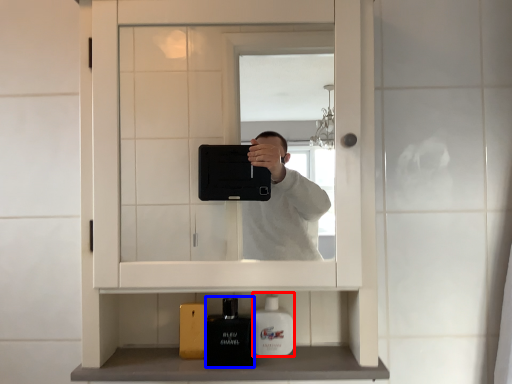
Question: Which point is closer to the camera, mouthwash (highlighted by a red box) or toiletry (highlighted by a blue box)?

Choices:
 (A) mouthwash
 (B) toiletry

Answer: (B)